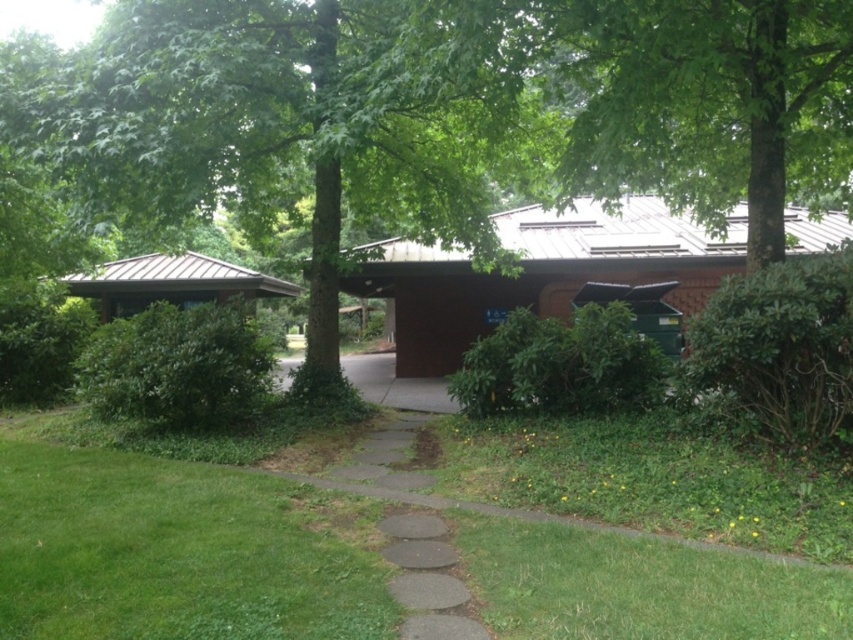
Can you confirm if green grass at lower left is smaller than green leafy tree at upper center?

Yes.

The image size is (853, 640). I want to click on green grass at lower left, so click(x=171, y=554).

Does point (32, 620) lie behind point (630, 150)?

No, (32, 620) is in front of (630, 150).

You are a GUI agent. You are given a task and a screenshot of the screen. Output one action in this format:
    pyautogui.click(x=<x>, y=<y>)
    Task: Click on the green grass at lower left
    The width and height of the screenshot is (853, 640).
    Given the screenshot: What is the action you would take?
    pyautogui.click(x=171, y=554)

Which of these two, green leafy tree at upper center or brown concrete driveway at center, stands shorter?

green leafy tree at upper center

In the scene shown: Which is below, green leafy tree at upper center or brown concrete driveway at center?

brown concrete driveway at center is lower down.

Where is `green leafy tree at upper center`? The width and height of the screenshot is (853, 640). green leafy tree at upper center is located at coordinates (711, 104).

Can you confirm if green leafy tree at center is positioned above green leafy tree at upper center?

No, green leafy tree at center is not above green leafy tree at upper center.

Can you confirm if green leafy tree at center is positioned to the left of green leafy tree at upper center?

Indeed, green leafy tree at center is positioned on the left side of green leafy tree at upper center.

Identify the location of green leafy tree at center. (293, 122).